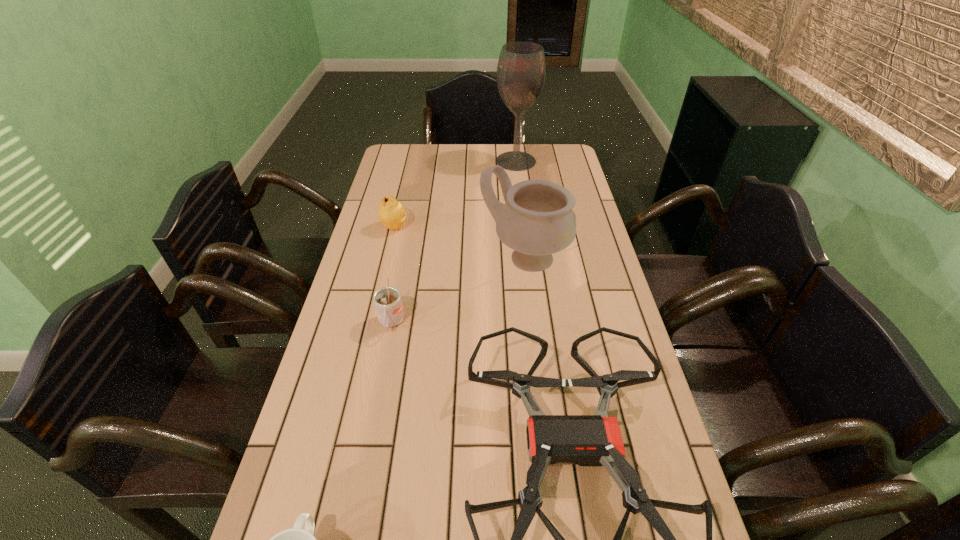
Find the location of `pear located at the left edge`. pear located at the left edge is located at coordinates (391, 213).

This screenshot has height=540, width=960. Identify the location of cup located at the left edge. (387, 300).

Locate an element on the screen. This screenshot has height=540, width=960. alcohol that is at the right edge is located at coordinates (521, 70).

Locate an element on the screen. pottery situated at the right edge is located at coordinates (537, 220).

Where is `object that is at the far right corner`? object that is at the far right corner is located at coordinates (521, 70).

Find the location of `vacant point at the far edge`. vacant point at the far edge is located at coordinates click(432, 163).

Where is `free space at the left edge of the desktop`? free space at the left edge of the desktop is located at coordinates (374, 396).

Identify the location of vacant space at the far right corner. The width and height of the screenshot is (960, 540). (564, 165).

This screenshot has height=540, width=960. Find the location of `free area in between the pear and the fourth farthest object`. free area in between the pear and the fourth farthest object is located at coordinates (393, 275).

The image size is (960, 540). Find the location of `the closest object to the nearer cup`. the closest object to the nearer cup is located at coordinates (587, 440).